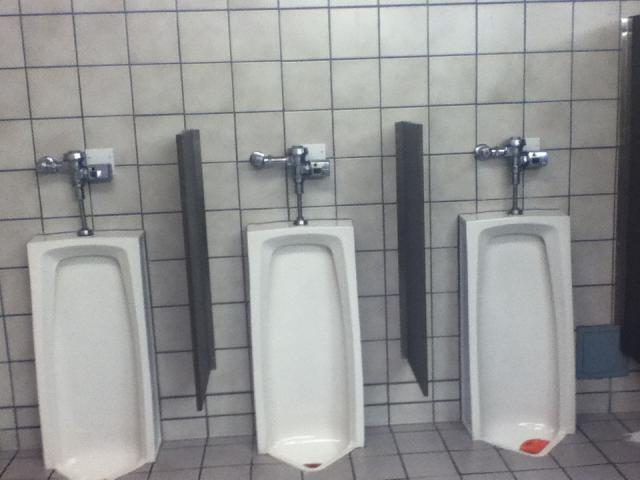
Identify the location of partition. (188, 195), (419, 182).